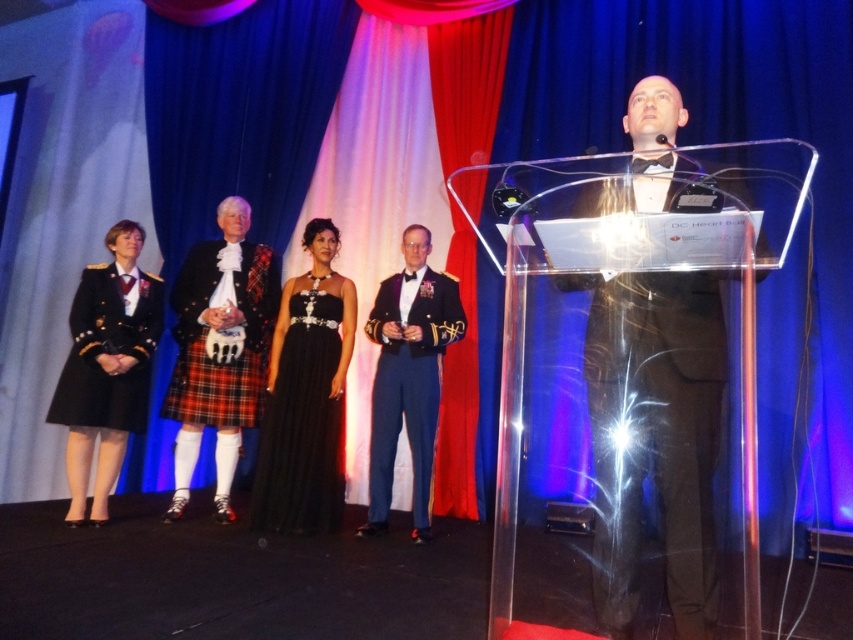
Who is shorter, black tuxedo at center or black satin dress at center?

Standing shorter between the two is black satin dress at center.

Between black tuxedo at center and black satin dress at center, which one is positioned lower?

black satin dress at center

Locate an element on the screen. The width and height of the screenshot is (853, 640). black tuxedo at center is located at coordinates (654, 436).

Is shiny blue uniform at center to the left of dark blue wool dress at left from the viewer's perspective?

Incorrect, shiny blue uniform at center is not on the left side of dark blue wool dress at left.

Is point (422, 380) closer to camera compared to point (88, 346)?

No, it is not.

I want to click on shiny blue uniform at center, so click(408, 376).

Can you confirm if red plaid kilt at center is positioned to the right of shiny blue uniform at center?

Incorrect, red plaid kilt at center is not on the right side of shiny blue uniform at center.

Based on the photo, does red plaid kilt at center have a greater height compared to shiny blue uniform at center?

Correct, red plaid kilt at center is much taller as shiny blue uniform at center.

Image resolution: width=853 pixels, height=640 pixels. Identify the location of red plaid kilt at center. (219, 349).